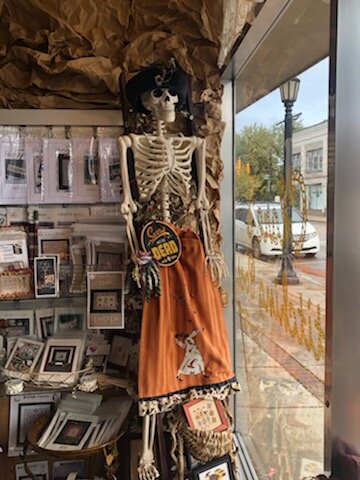
Image resolution: width=360 pixels, height=480 pixels. Find the location of `right door`. right door is located at coordinates (246, 231).